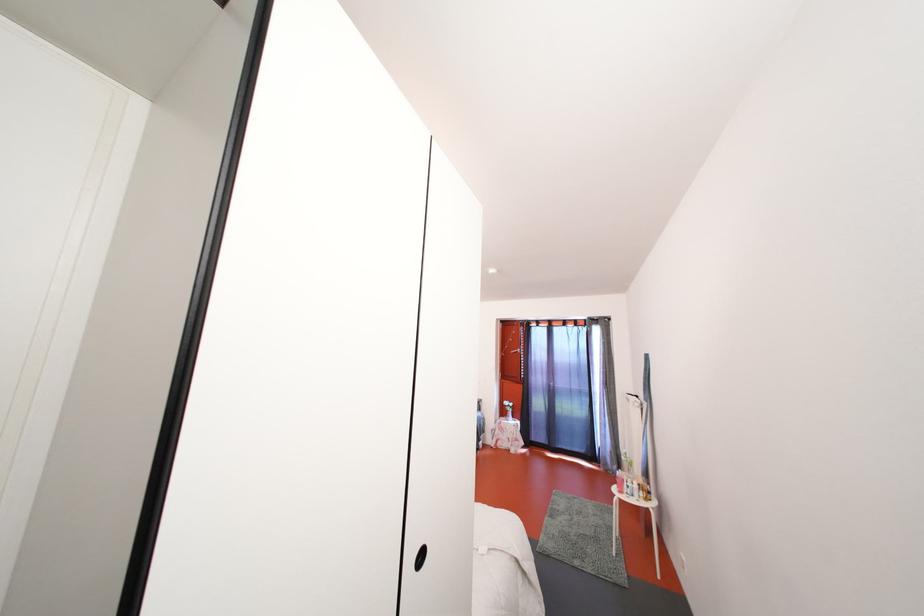
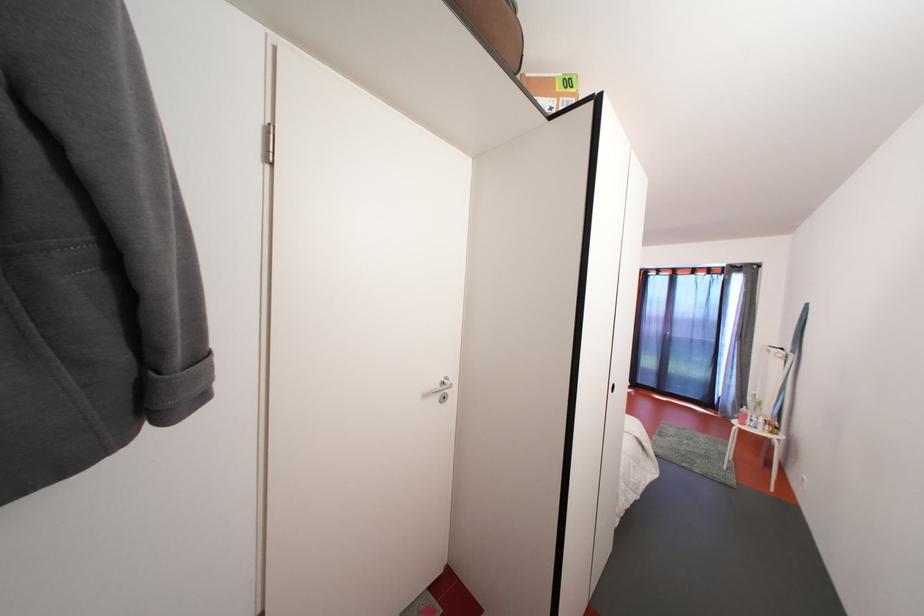
Question: I am providing you with two images of the same scene from different viewpoints. Please identify which objects are invisible in image2.

Choices:
 (A) silver door handle
 (B) small white vase
 (C) green spray bottle
 (D) blue water crate

Answer: (B)